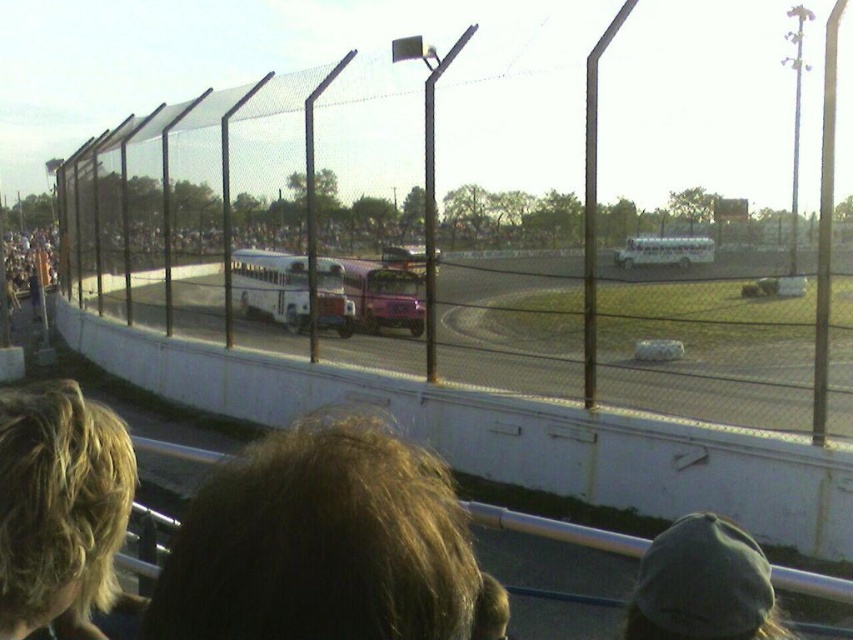
Question: Does brown hair at center have a smaller size compared to green fabric cap at lower right?

Choices:
 (A) no
 (B) yes

Answer: (A)

Question: Which object appears closest to the camera in this image?

Choices:
 (A) metallic chain-link fence at center
 (B) brown hair at center

Answer: (A)

Question: Observing the image, what is the correct spatial positioning of metallic chain-link fence at center in reference to green fabric cap at lower right?

Choices:
 (A) below
 (B) above

Answer: (B)

Question: Among these points, which one is farthest from the camera?

Choices:
 (A) (219, 477)
 (B) (703, 582)

Answer: (B)

Question: Which of the following is the closest to the observer?

Choices:
 (A) brown hair at center
 (B) green fabric cap at lower right
 (C) metallic chain-link fence at center

Answer: (B)

Question: Considering the relative positions of brown hair at center and blonde hair at upper left in the image provided, where is brown hair at center located with respect to blonde hair at upper left?

Choices:
 (A) right
 (B) left

Answer: (B)